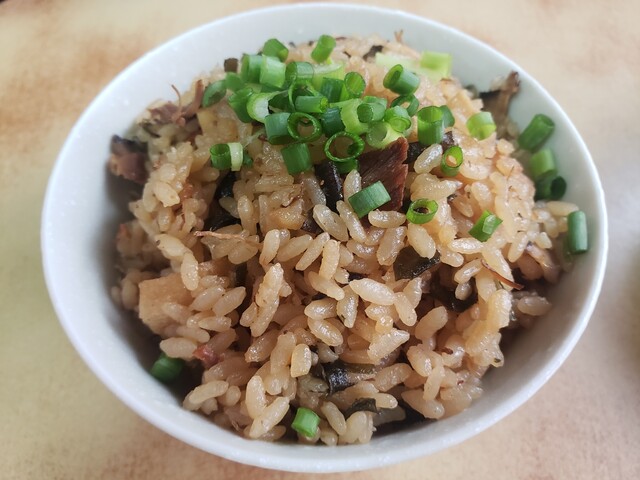
At what (x,y) coordinates should I click in order to perform the action: click on wooden table. Please return your answer as a coordinate pair (x, y). Looking at the image, I should click on (36, 404).